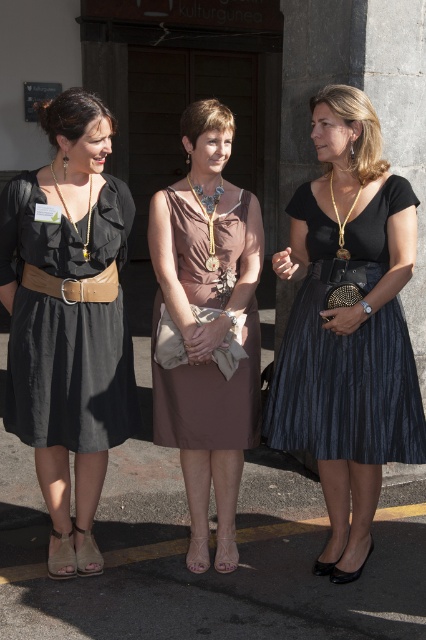
You are a photographer trying to capture a closeup of the name tag on the left woman while also ensuring the brown leather belt at center and matte brown dress at center are visible in the frame. Which part of the woman on the left should you focus on to include both the belt and the dress?

The matte brown dress at center is positioned under the brown leather belt at center, so focusing on the lower torso area of the woman on the left will allow you to capture both the belt and the dress in the frame.

You are a photographer trying to capture a group photo of the shiny black skirt at center and the matte brown dress at center. If you want to ensure both are fully visible in the frame, which object should you position closer to the camera to avoid cropping?

The shiny black skirt at center should be positioned closer to the camera because it might be wider than the matte brown dress at center, ensuring it fits within the frame without cropping.

You are organizing a fashion show and need to ensure that the shiny black skirt at center and the brown leather belt at center fit within a display case that is 1 meter wide. Based on their widths, can both items be displayed side by side without overlapping?

The shiny black skirt at center is wider than the brown leather belt at center. Since the total width of both items combined would exceed the 1 meter display case, they cannot be displayed side by side without overlapping.